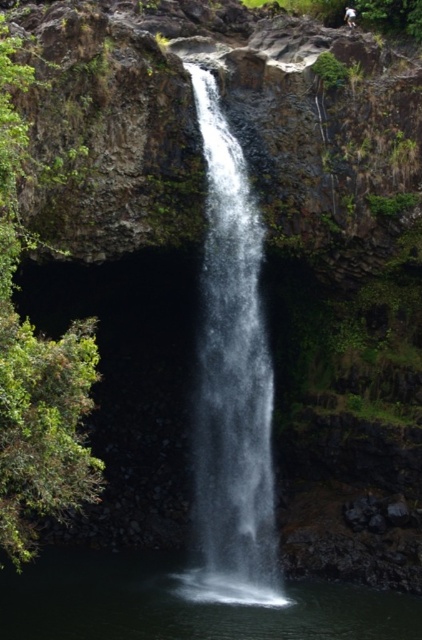
Between clear water at center and white frothy water at center, which one appears on the left side from the viewer's perspective?

From the viewer's perspective, white frothy water at center appears more on the left side.

Can you confirm if clear water at center is wider than white frothy water at center?

No, clear water at center is not wider than white frothy water at center.

Who is more forward, (251, 508) or (129, 579)?

Point (129, 579)

Where is `clear water at center`? The image size is (422, 640). clear water at center is located at coordinates (232, 384).

Who is more forward, (x=148, y=568) or (x=351, y=16)?

Point (x=148, y=568) is in front.

Based on the photo, which is below, white frothy water at center or white cotton shirt at center?

Positioned lower is white frothy water at center.

Where is `white frothy water at center`? This screenshot has width=422, height=640. white frothy water at center is located at coordinates (181, 604).

Which is above, clear water at center or white cotton shirt at center?

white cotton shirt at center

Can you confirm if clear water at center is positioned to the left of white cotton shirt at center?

Yes, clear water at center is to the left of white cotton shirt at center.

Who is more distant from viewer, (221, 172) or (352, 13)?

The point (352, 13) is behind.

Where is `clear water at center`? clear water at center is located at coordinates (232, 384).